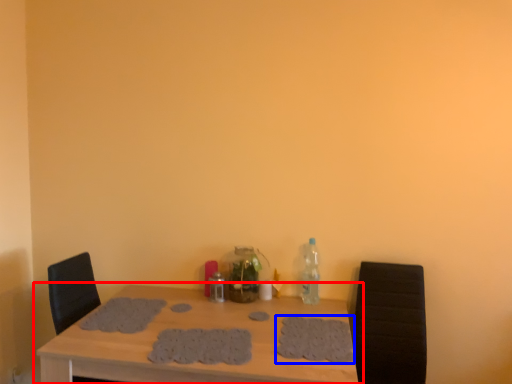
Question: Among these objects, which one is farthest to the camera, table (highlighted by a red box) or footprint (highlighted by a blue box)?

Choices:
 (A) table
 (B) footprint

Answer: (B)